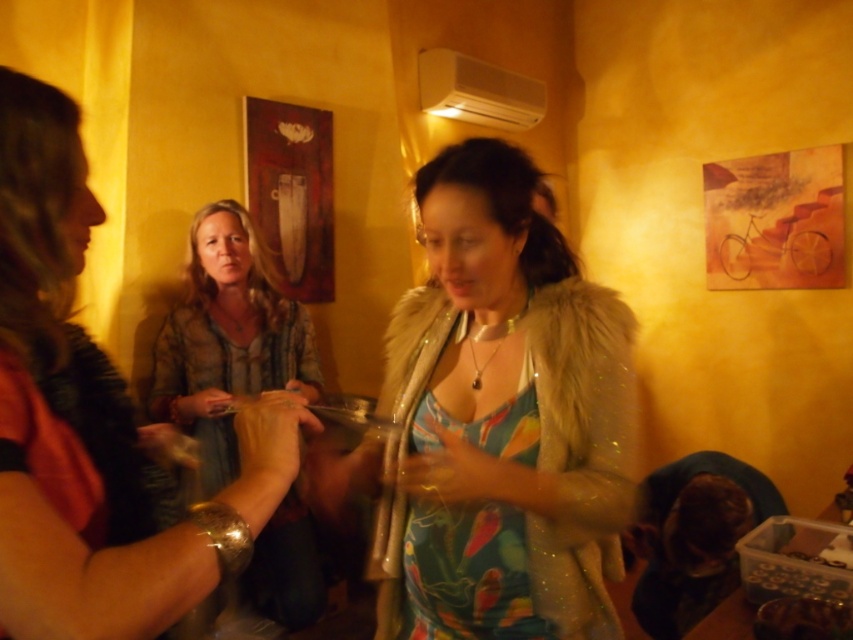
Who is taller, fuzzy fur coat at center or rustic brown shirt at center?

rustic brown shirt at center

Locate an element on the screen. fuzzy fur coat at center is located at coordinates (502, 419).

Where is `fuzzy fur coat at center`? This screenshot has height=640, width=853. fuzzy fur coat at center is located at coordinates (502, 419).

Does fuzzy fur coat at center come behind matte brown shirt at center?

That is True.

Can you confirm if fuzzy fur coat at center is positioned below matte brown shirt at center?

Correct, fuzzy fur coat at center is located below matte brown shirt at center.

Who is more forward, (459, 596) or (16, 396)?

Point (16, 396)

I want to click on fuzzy fur coat at center, so click(x=502, y=419).

Between rustic brown shirt at center and floral fabric dress at center, which one has more height?

rustic brown shirt at center is taller.

Measure the distance between point (201, 417) and camera.

Point (201, 417) and camera are 6.34 feet apart from each other.

Identify the location of rustic brown shirt at center. (227, 339).